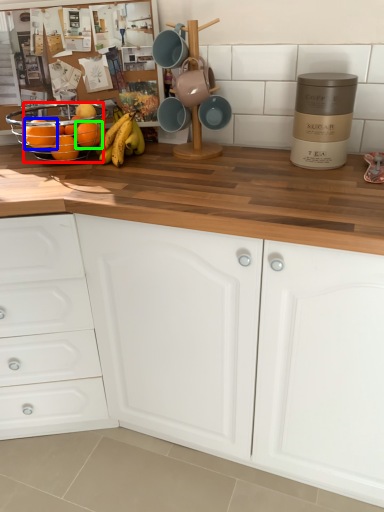
Question: Which object is positioned closest to orange (highlighted by a red box)? Select from orange (highlighted by a blue box) and orange (highlighted by a green box).

Choices:
 (A) orange
 (B) orange

Answer: (A)